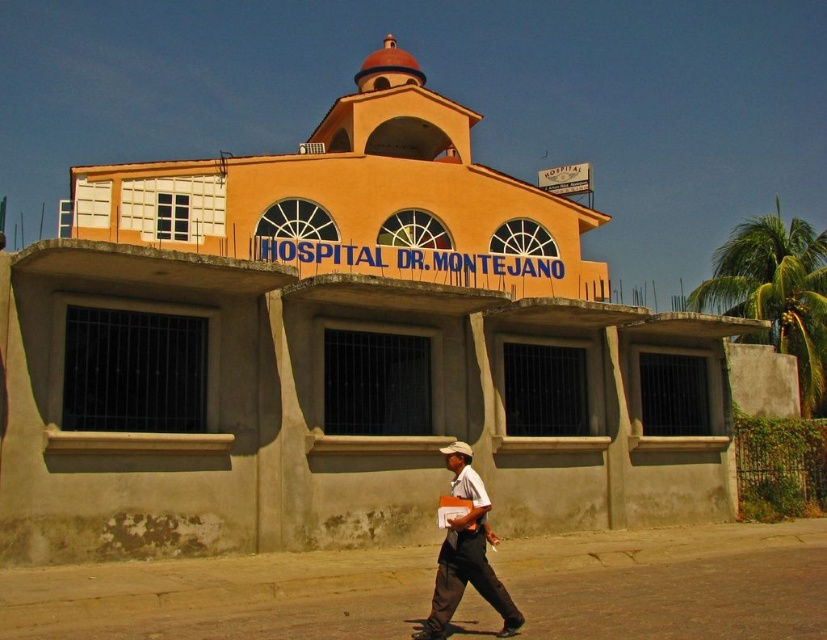
You are standing in front of the HOSPITAL DR. MONTEJANO building. You see a brown cotton shirt at lower center and a white matte cowboy hat at center. Which object is closer to you?

The brown cotton shirt at lower center is closer to you because it is in front of the white matte cowboy hat at center.

You are standing in front of the HOSPITAL DR. MONTEJANO building. There are two points marked on the building facade. The first point is at coordinate point (x=495, y=604) and the second point is at coordinate point (x=447, y=445). Which point is closer to you?

Point (x=495, y=604) is closer to the viewer than point (x=447, y=445).